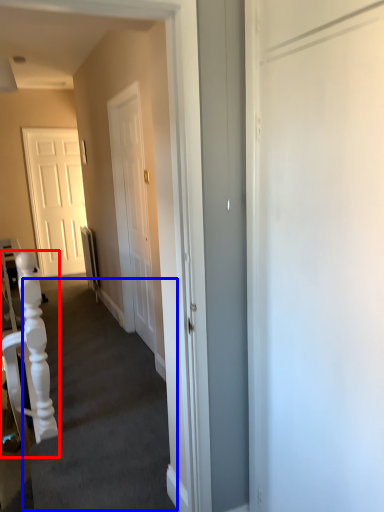
Question: Which point is further to the camera, armchair (highlighted by a red box) or stairwell (highlighted by a blue box)?

Choices:
 (A) armchair
 (B) stairwell

Answer: (A)